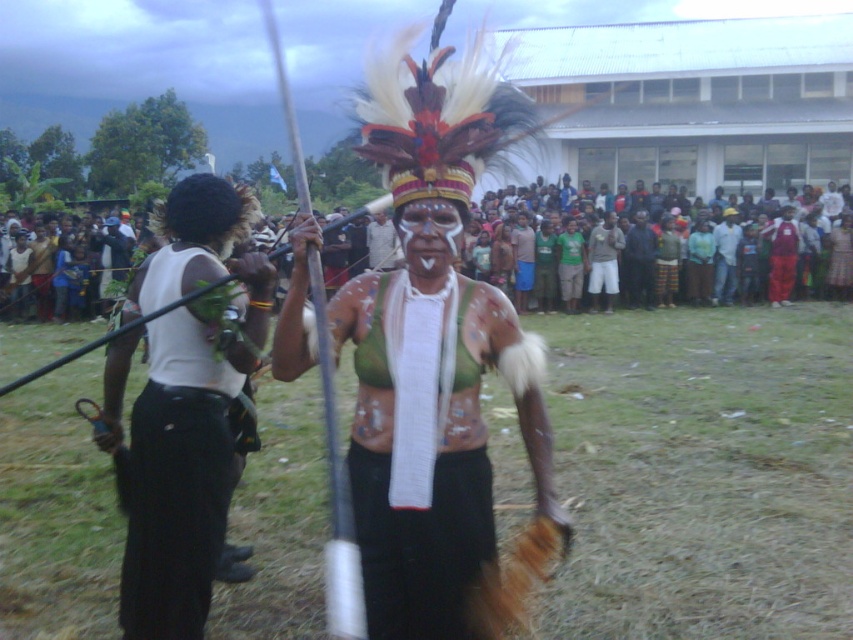
You are an artist trying to sketch this scene. You notice the matte green feathered vest at center and the white matte face at center. Which object should you draw first if you want to follow the rule of starting with the larger object?

The matte green feathered vest at center should be drawn first because it has a larger size compared to the white matte face at center.

You are an anthropologist observing this cultural event. You notice the matte green feathered vest at center and the white matte face at center. Which object is taller?

The matte green feathered vest at center is taller than the white matte face at center.

You are a photographer at this event and want to capture both the white matte vest at left and the white matte face at center in a single frame. Given their height difference, which object should you focus on first to ensure both are visible in the photo?

The white matte vest at left is much taller than the white matte face at center, so you should focus on the white matte vest at left first to ensure both are visible in the photo.